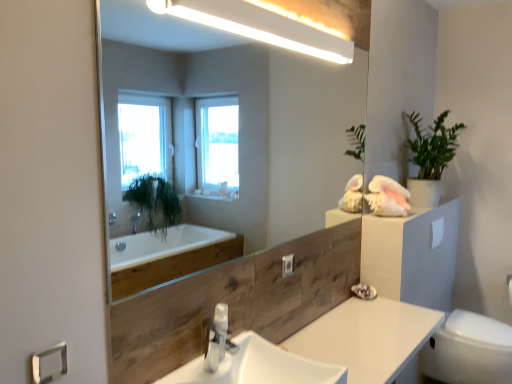
Question: Would you say white glossy countertop at center is inside or outside white matte toilet paper at right?

Choices:
 (A) outside
 (B) inside

Answer: (A)

Question: From the image's perspective, is white glossy countertop at center positioned above or below white matte toilet paper at right?

Choices:
 (A) below
 (B) above

Answer: (A)

Question: Which is nearer to the white glossy toilet bowl at lower right?

Choices:
 (A) white glossy sink at center
 (B) silver metallic towel bar at lower left
 (C) satin nickel faucet at center
 (D) white matte toilet paper at right
 (E) white glossy countertop at center

Answer: (D)

Question: Considering the real-world distances, which object is farthest from the satin nickel faucet at center?

Choices:
 (A) silver metallic towel bar at lower left
 (B) white matte toilet paper at right
 (C) white glossy toilet bowl at lower right
 (D) green matte plant at upper right
 (E) white glossy countertop at center

Answer: (D)